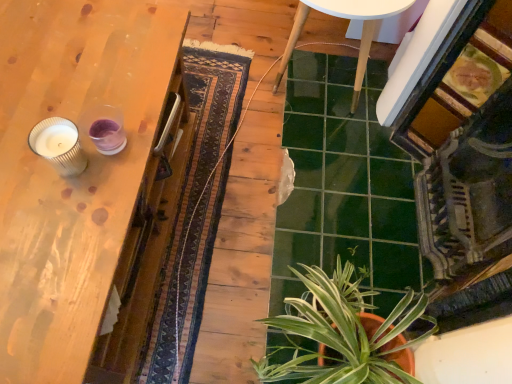
The width and height of the screenshot is (512, 384). I want to click on unoccupied space behind ridged glass candle at left, so click(x=92, y=90).